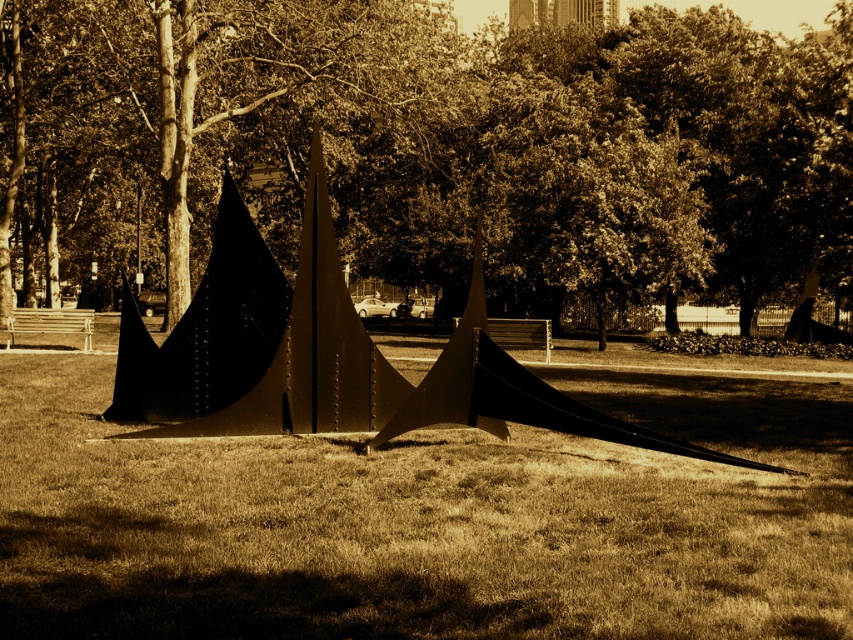
In the scene shown: You are a landscape architect designing a new park and want to ensure proper spacing between the brown textured tree at upper center and the brown matte grass at center. According to the scene provided, what is the minimum distance you should maintain between them?

The brown textured tree at upper center is 15.27 meters from the brown matte grass at center, so the minimum distance should be at least 15.27 meters to maintain the same spacing as in the scene.

You are standing in the park and want to take a photo of the modern sculpture. There is a brown textured tree at upper center that might block your view. Can you see the sculpture if you stand at the point marked by coordinates point (437, 147)?

The brown textured tree at upper center is represented by point (437, 147), so standing there would place you directly at the tree, likely blocking your view of the sculpture.

You are an urban planner assessing the park layout. The brown textured tree at upper center and the metallic gold pyramid at center are both within your field of view. Which object occupies more horizontal space in the image?

The brown textured tree at upper center occupies more horizontal space than the metallic gold pyramid at center because its width surpasses the pyramid.